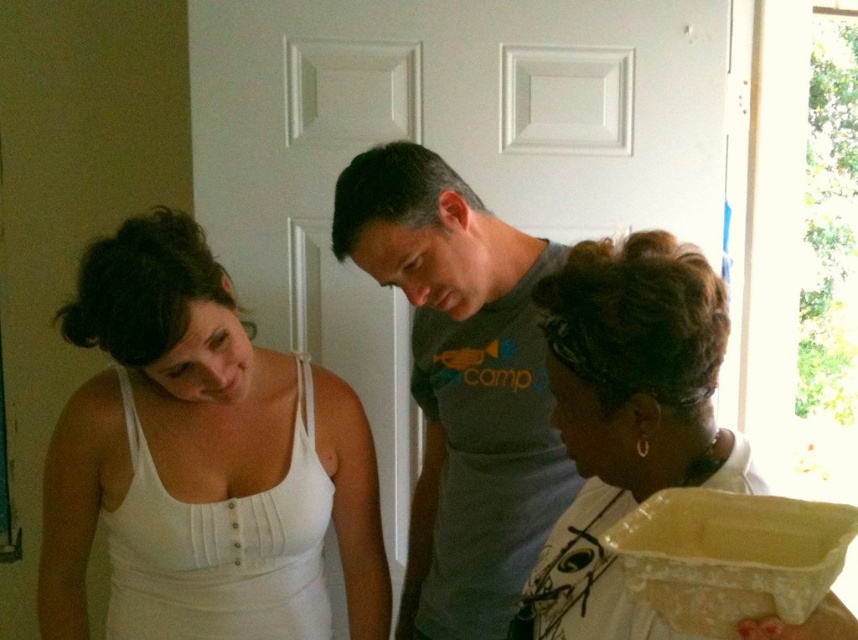
Question: Observing the image, what is the correct spatial positioning of white fabric tank top at left in reference to yellow plastic tray at lower right?

Choices:
 (A) right
 (B) left

Answer: (B)

Question: Is gray cotton t-shirt at center closer to the viewer compared to yellow plastic tray at lower right?

Choices:
 (A) no
 (B) yes

Answer: (A)

Question: Is white fabric tank top at left positioned before white fabric tank top at lower left?

Choices:
 (A) no
 (B) yes

Answer: (B)

Question: Based on their relative distances, which object is nearer to the gray cotton t-shirt at center?

Choices:
 (A) yellow plastic tray at lower right
 (B) white fabric at lower right
 (C) white fabric tank top at left

Answer: (C)

Question: Estimate the real-world distances between objects in this image. Which object is closer to the white fabric tank top at lower left?

Choices:
 (A) yellow plastic tray at lower right
 (B) white fabric tank top at left

Answer: (B)

Question: Which object appears closest to the camera in this image?

Choices:
 (A) white fabric at lower right
 (B) yellow plastic tray at lower right
 (C) white fabric tank top at lower left

Answer: (A)